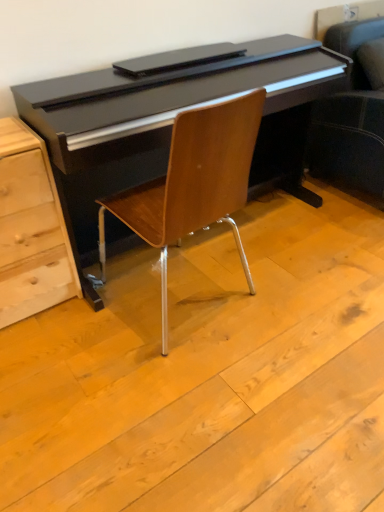
The width and height of the screenshot is (384, 512). Find the location of `free spot to the right of light wood chest of drawers at lower left`. free spot to the right of light wood chest of drawers at lower left is located at coordinates (92, 317).